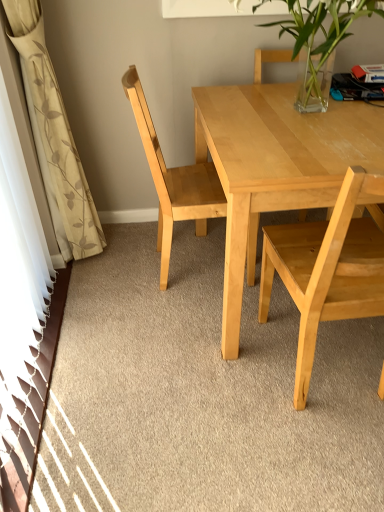
This screenshot has height=512, width=384. Identify the location of free space to the left of light wood chair at right, marked as the 1th chair in a right-to-left arrangement. (209, 378).